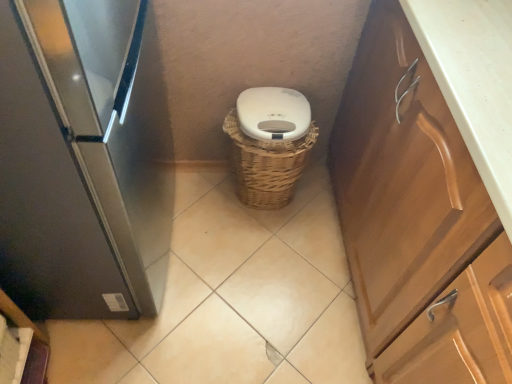
Where is `vacant area that lies between satin black refrigerator at left and woven brown basket at center`? This screenshot has width=512, height=384. vacant area that lies between satin black refrigerator at left and woven brown basket at center is located at coordinates tap(212, 235).